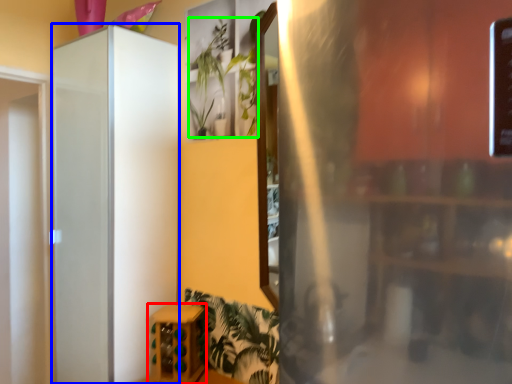
Question: Which object is the closest to the furniture (highlighted by a red box)? Choose among these: screen door (highlighted by a blue box) or plant (highlighted by a green box).

Choices:
 (A) screen door
 (B) plant

Answer: (A)